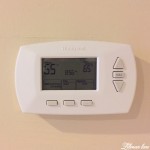
Find the location of a particular element. The width and height of the screenshot is (150, 150). wall is located at coordinates (83, 19).